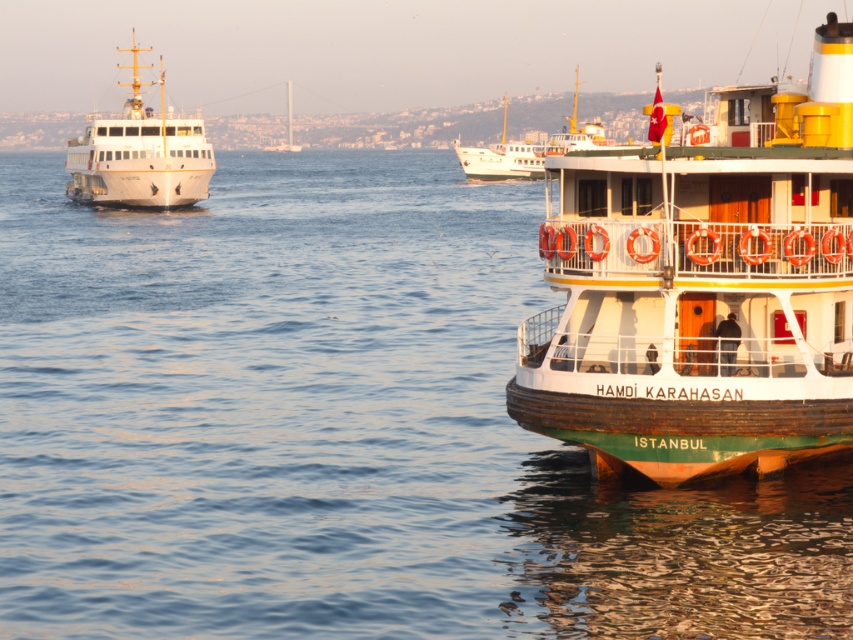
Can you confirm if white glossy ferry at upper left is taller than white matte boat at center?

Yes, white glossy ferry at upper left is taller than white matte boat at center.

Is point (212, 157) farther from camera compared to point (496, 168)?

No, it is not.

Identify the location of white glossy ferry at upper left. The width and height of the screenshot is (853, 640). (138, 154).

Is point (525, 392) farther from viewer compared to point (181, 124)?

No, it is not.

In the scene shown: Between wooden ship at right and white glossy ferry at upper left, which one is positioned lower?

wooden ship at right is below.

Between point (637, 337) and point (125, 152), which one is positioned behind?

Point (125, 152)

The width and height of the screenshot is (853, 640). In order to click on wooden ship at right in this screenshot , I will do `click(703, 288)`.

Is point (531, 378) more distant than point (534, 148)?

No.

At what (x,y) coordinates should I click in order to perform the action: click on wooden ship at right. Please return your answer as a coordinate pair (x, y). This screenshot has width=853, height=640. Looking at the image, I should click on tap(703, 288).